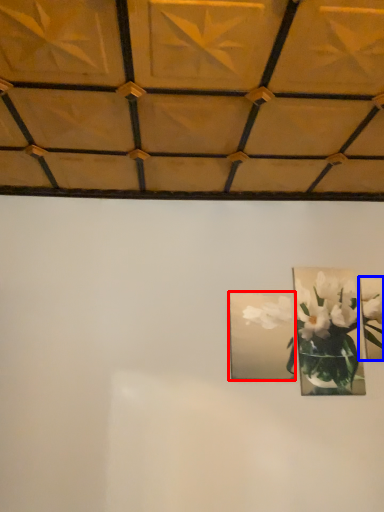
Question: Which point is closer to the camera, picture frame (highlighted by a red box) or picture frame (highlighted by a blue box)?

Choices:
 (A) picture frame
 (B) picture frame

Answer: (A)